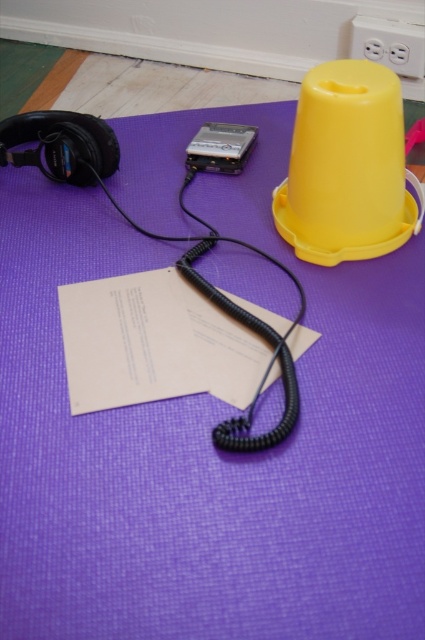
The width and height of the screenshot is (425, 640). In order to click on white paper at center in this screenshot , I will do pyautogui.click(x=153, y=342).

Does white paper at center have a larger size compared to yellow plastic cone at upper right?

No, white paper at center is not bigger than yellow plastic cone at upper right.

Who is more forward, (x=229, y=401) or (x=351, y=186)?

Point (x=229, y=401) is more forward.

Locate an element on the screen. This screenshot has width=425, height=640. white paper at center is located at coordinates (153, 342).

Who is positioned more to the right, yellow plastic cone at upper right or matte black headphones at upper left?

Positioned to the right is yellow plastic cone at upper right.

The image size is (425, 640). Identify the location of yellow plastic cone at upper right. (346, 168).

Is point (385, 132) positioned behind point (11, 138)?

No, (385, 132) is in front of (11, 138).

Locate an element on the screen. This screenshot has width=425, height=640. yellow plastic cone at upper right is located at coordinates (346, 168).

Is point (71, 163) closer to viewer compared to point (234, 148)?

Yes, point (71, 163) is in front of point (234, 148).

Can you confirm if matte black headphones at upper left is positioned to the right of satin black ipod at center?

In fact, matte black headphones at upper left is to the left of satin black ipod at center.

This screenshot has width=425, height=640. Describe the element at coordinates (62, 145) in the screenshot. I see `matte black headphones at upper left` at that location.

This screenshot has width=425, height=640. What are the coordinates of `matte black headphones at upper left` in the screenshot? It's located at (62, 145).